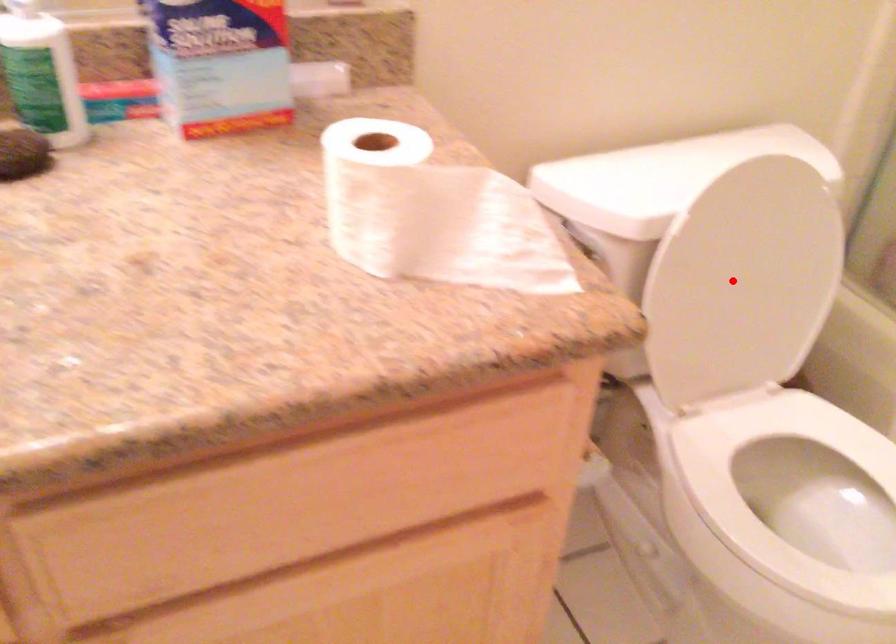
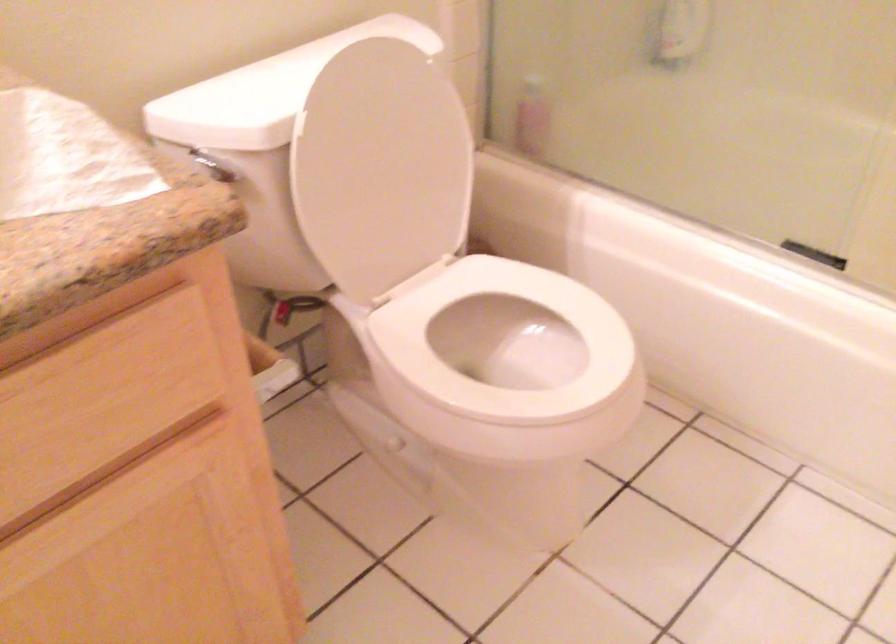
Find the pixel in the second image that matches the highlighted location in the first image.

(381, 167)